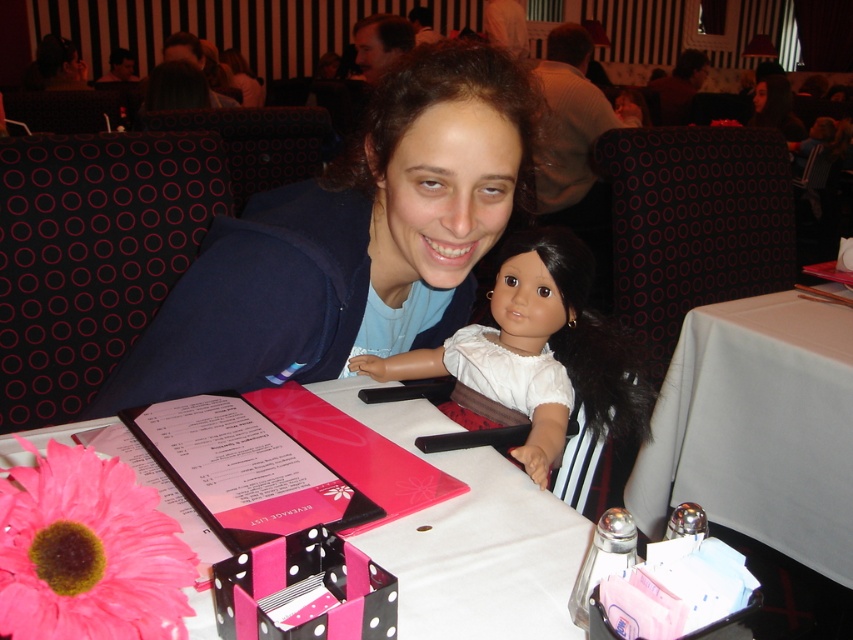
Is blue fabric at center smaller than white matte doll at center?

Actually, blue fabric at center might be larger than white matte doll at center.

At what (x,y) coordinates should I click in order to perform the action: click on blue fabric at center. Please return your answer as a coordinate pair (x, y). The image size is (853, 640). Looking at the image, I should click on (349, 236).

The width and height of the screenshot is (853, 640). Find the location of `blue fabric at center`. blue fabric at center is located at coordinates pyautogui.click(x=349, y=236).

This screenshot has width=853, height=640. In order to click on blue fabric at center in this screenshot , I will do `click(349, 236)`.

Can you confirm if blue fabric at center is bigger than white fabric table at right?

No, blue fabric at center is not bigger than white fabric table at right.

Who is higher up, blue fabric at center or white fabric table at right?

Positioned higher is blue fabric at center.

You are a GUI agent. You are given a task and a screenshot of the screen. Output one action in this format:
    pyautogui.click(x=<x>, y=<y>)
    Task: Click on the blue fabric at center
    The height and width of the screenshot is (640, 853).
    Given the screenshot: What is the action you would take?
    pyautogui.click(x=349, y=236)

Does white fabric table at right appear over white matte doll at center?

No.

Between white fabric table at right and white matte doll at center, which one has less height?

Standing shorter between the two is white matte doll at center.

Is point (695, 320) behind point (618, 404)?

Yes, point (695, 320) is farther from viewer.

This screenshot has width=853, height=640. What are the coordinates of `white fabric table at right` in the screenshot? It's located at (757, 428).